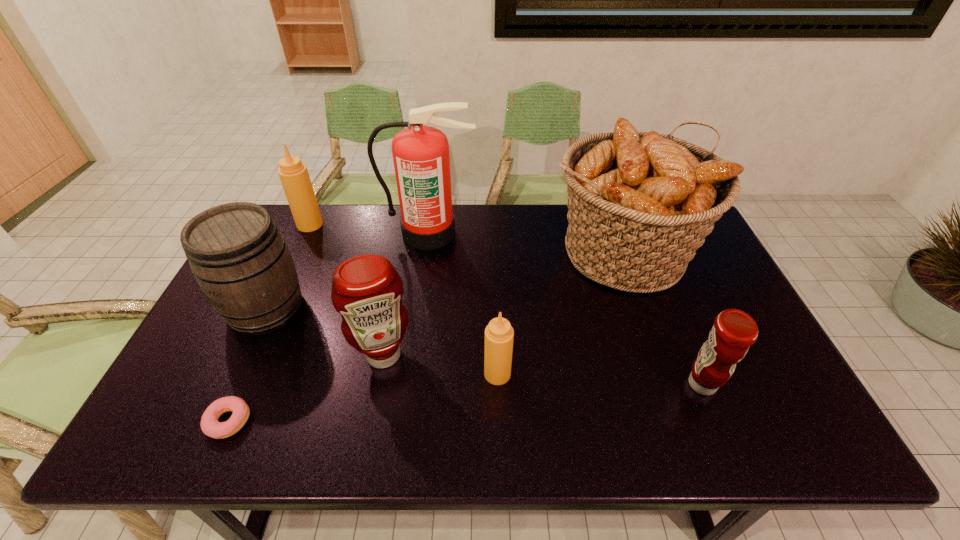
I want to click on condiment present at the right edge, so click(734, 331).

The image size is (960, 540). I want to click on object at the far left corner, so click(294, 176).

Locate an element on the screen. This screenshot has height=540, width=960. object present at the near left corner is located at coordinates (210, 425).

Where is `object situated at the far right corner`? The width and height of the screenshot is (960, 540). object situated at the far right corner is located at coordinates (640, 204).

The image size is (960, 540). I want to click on blank area at the far edge, so click(507, 242).

Identify the location of vacant point at the near edge. (587, 418).

You are a GUI agent. You are given a task and a screenshot of the screen. Output one action in this format:
    pyautogui.click(x=<x>, y=<y>)
    Task: Click on the blank area at the right edge
    The image size is (960, 540).
    Given the screenshot: What is the action you would take?
    pyautogui.click(x=700, y=297)

Identify the location of vacant area that lies between the tallest object and the rightmost condiment. (565, 308).

Locate an element on the screen. This screenshot has height=540, width=960. empty location between the wine bucket and the bigger red condiment is located at coordinates (324, 332).

I want to click on vacant area that lies between the wine bucket and the bigger red condiment, so click(324, 332).